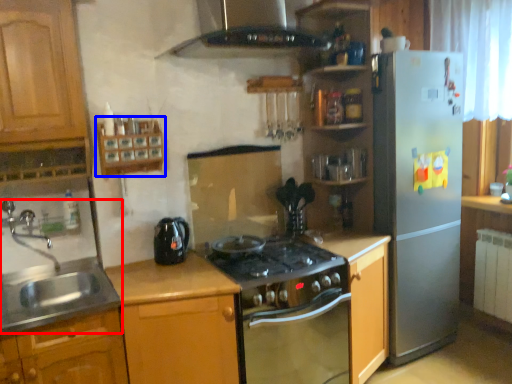
Question: Which point is further to the camera, sink (highlighted by a red box) or shelf (highlighted by a blue box)?

Choices:
 (A) sink
 (B) shelf

Answer: (B)